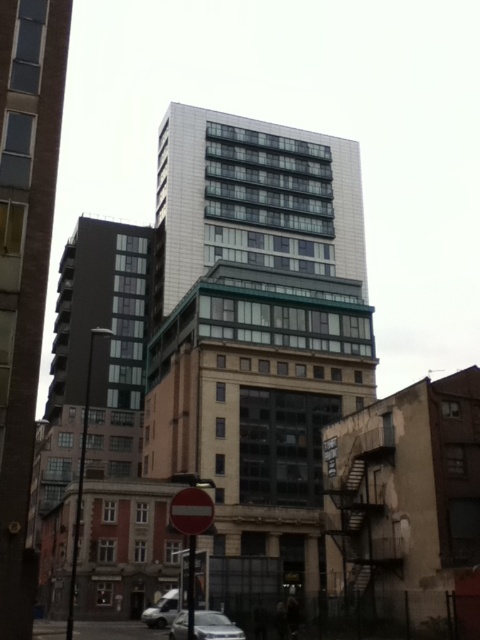
You are an architect analyzing the urban layout. There is a point marked at coordinates (x=24, y=268) in the image. Which building does this point correspond to?

The point at coordinates (x=24, y=268) corresponds to the matte glass building at center.

You are a pedestrian standing on the sidewalk in front of the central building. You see the red plastic sign at lower center and the silver metallic car at lower center. Which object is positioned higher relative to the other?

The red plastic sign at lower center is above the silver metallic car at lower center, so it is positioned higher.

You are standing at a viewpoint 100 feet away from a cluster of buildings. You notice a specific point labeled as point (13, 412) in the scene. Based on the information provided, is this point closer to you or farther away than your current position?

The distance of point (13, 412) from viewer is 92.15 feet, which is closer than your current position at 100 feet away. Therefore, the point is closer to you.